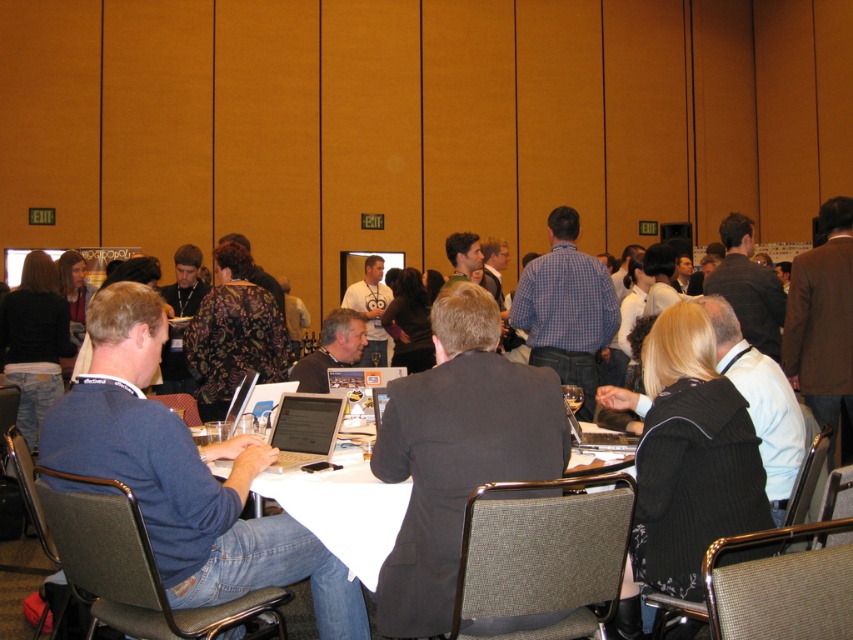
Does matte black jacket at center have a smaller size compared to metallic gray chair at lower left?

Incorrect, matte black jacket at center is not smaller in size than metallic gray chair at lower left.

Can you confirm if matte black jacket at center is positioned below metallic gray chair at lower left?

No, matte black jacket at center is not below metallic gray chair at lower left.

Locate an element on the screen. This screenshot has width=853, height=640. matte black jacket at center is located at coordinates (331, 349).

Based on the photo, who is lower down, dark gray suit at center or gray fabric chair at lower left?

Result: gray fabric chair at lower left is lower down.

Does dark gray suit at center have a lesser height compared to gray fabric chair at lower left?

In fact, dark gray suit at center may be taller than gray fabric chair at lower left.

Between point (508, 627) and point (225, 627), which one is positioned behind?

The point (225, 627) is more distant.

You are a GUI agent. You are given a task and a screenshot of the screen. Output one action in this format:
    pyautogui.click(x=<x>, y=<y>)
    Task: Click on the dark gray suit at center
    The width and height of the screenshot is (853, 640).
    Given the screenshot: What is the action you would take?
    pyautogui.click(x=457, y=452)

Does gray fabric chair at center have a larger size compared to metallic gray chair at lower left?

Yes, gray fabric chair at center is bigger than metallic gray chair at lower left.

Who is shorter, gray fabric chair at center or metallic gray chair at lower left?

gray fabric chair at center is shorter.

Who is more distant from viewer, (x=555, y=525) or (x=16, y=396)?

The point (x=16, y=396) is more distant.

Where is `gray fabric chair at center`? This screenshot has width=853, height=640. gray fabric chair at center is located at coordinates (543, 556).